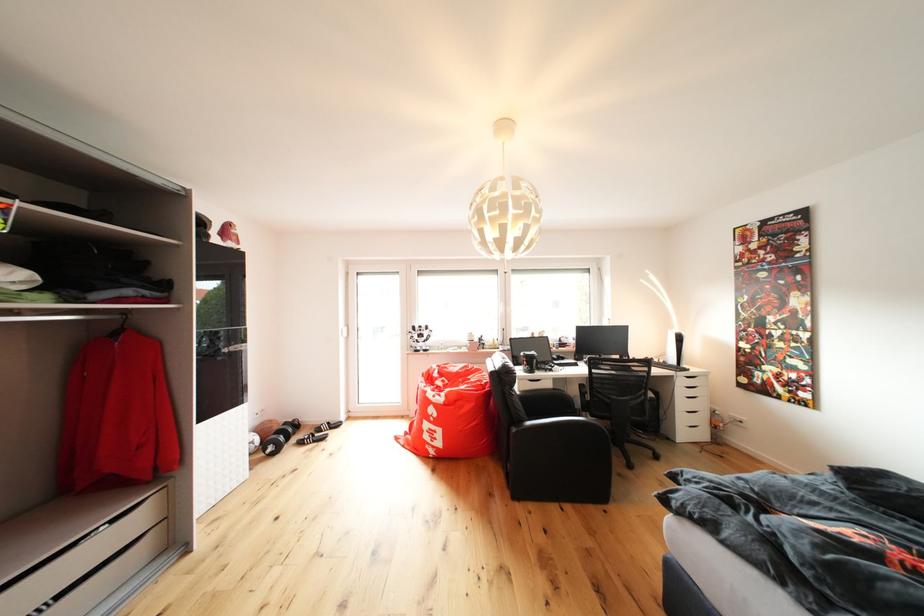
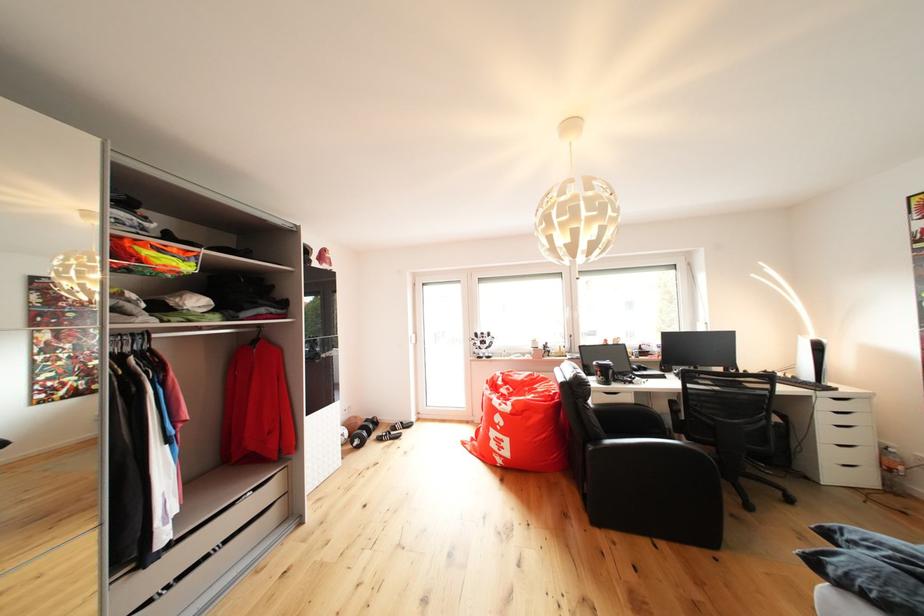
In the second image, find the point that corresponds to point (696, 431) in the first image.

(846, 469)